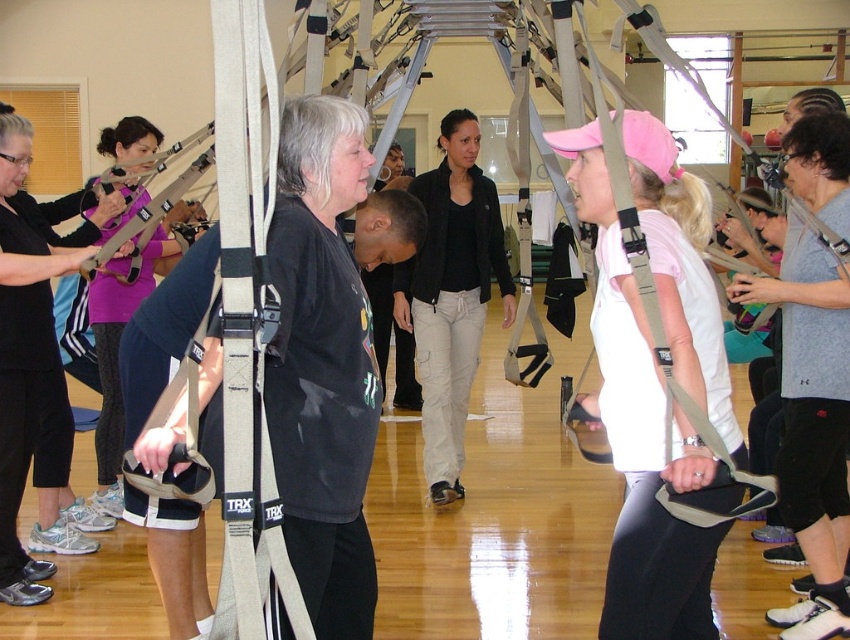
Is the position of matte black shirt at center more distant than that of black cotton jacket at center?

No.

Measure the distance from matte black shirt at center to black cotton jacket at center.

matte black shirt at center is 9.82 feet away from black cotton jacket at center.

I want to click on matte black shirt at center, so click(323, 365).

Is point (823, 499) more distant than point (434, 480)?

No, it is in front of (434, 480).

How distant is gray cotton shirt at center from black cotton jacket at center?

gray cotton shirt at center and black cotton jacket at center are 7.30 feet apart.

Does point (816, 604) come closer to viewer compared to point (445, 209)?

Yes, it is in front of point (445, 209).

At what (x,y) coordinates should I click in order to perform the action: click on gray cotton shirt at center. Please return your answer as a coordinate pair (x, y). The height and width of the screenshot is (640, 850). Looking at the image, I should click on (811, 422).

Is matte black shirt at center thinner than gray cotton shirt at center?

Correct, matte black shirt at center's width is less than gray cotton shirt at center's.

Which is behind, point (276, 449) or point (785, 611)?

The point (785, 611) is more distant.

Locate an element on the screen. matte black shirt at center is located at coordinates (323, 365).